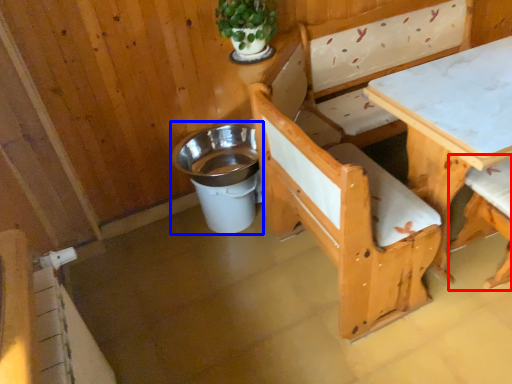
Question: Which object appears farthest to the camera in this image, chair (highlighted by a red box) or trash bin/can (highlighted by a blue box)?

Choices:
 (A) chair
 (B) trash bin/can

Answer: (B)